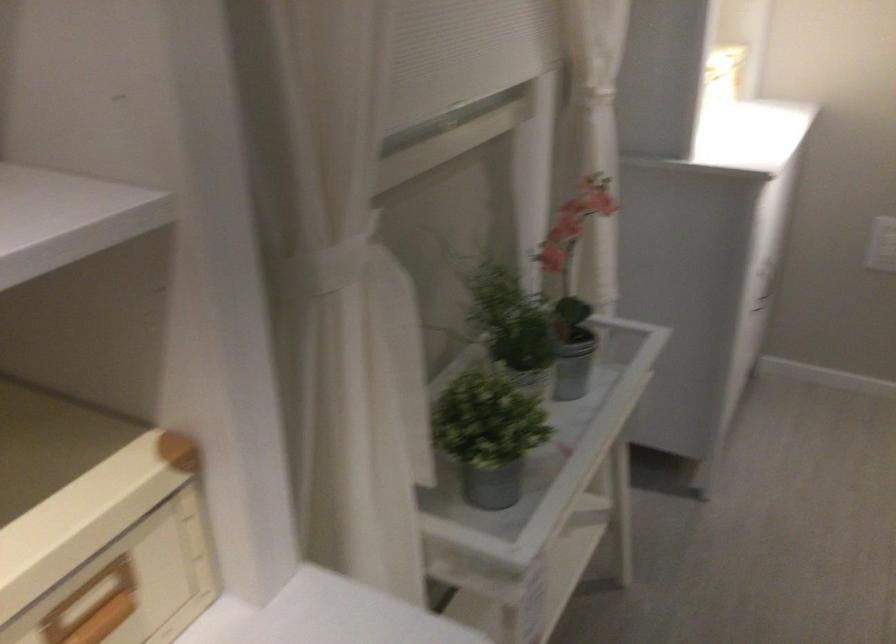
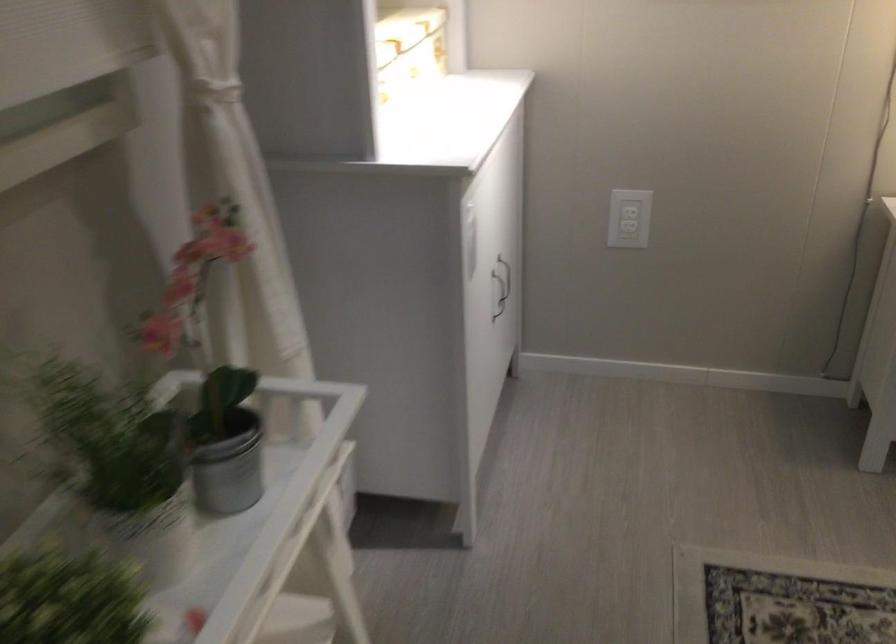
In a continuous first-person perspective shot, in which direction is the camera moving?

The cameraman walked toward right, forward.